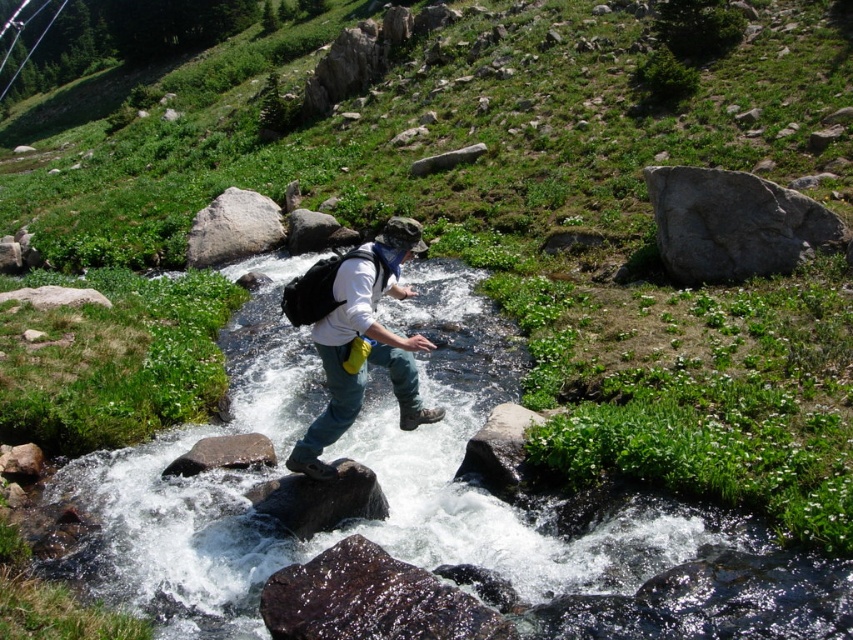
You are a hiker trying to cross the stream. You see two rocks in the middle of the stream, a gray rough rock at center and a gray smooth rock at center. Which rock has a wider surface to step on?

The gray rough rock at center has a wider surface than the gray smooth rock at center, so it is better to step on the gray rough rock at center.

You are a hiker trying to cross the stream safely. You see the clear water at center and the gray rough rock at center. Which object should you step on to avoid getting your boots wet?

You should step on the gray rough rock at center because the clear water at center is located below it, meaning the rock is above the water level and provides a dry path.